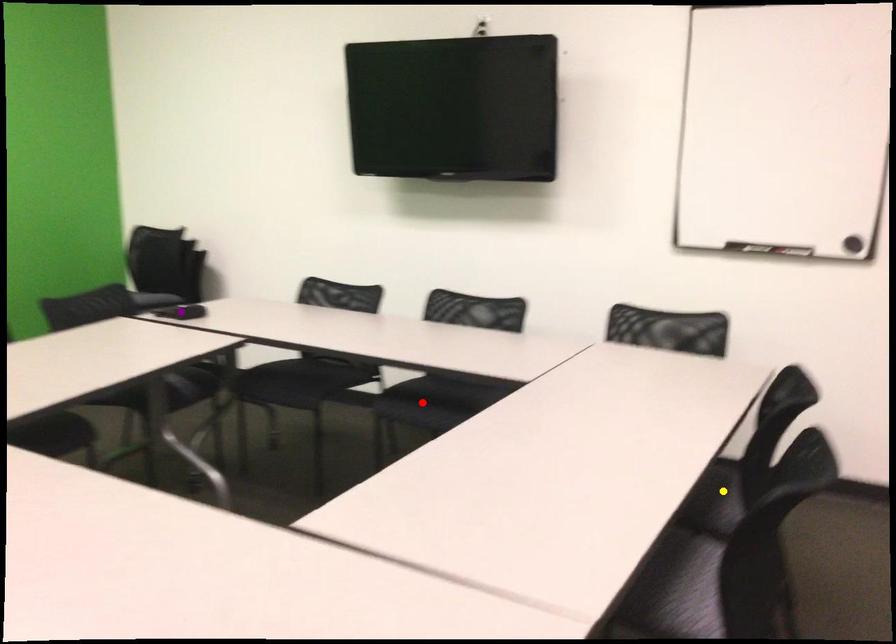
Order these from nearest to farthest:
- purple point
- yellow point
- red point

yellow point, red point, purple point